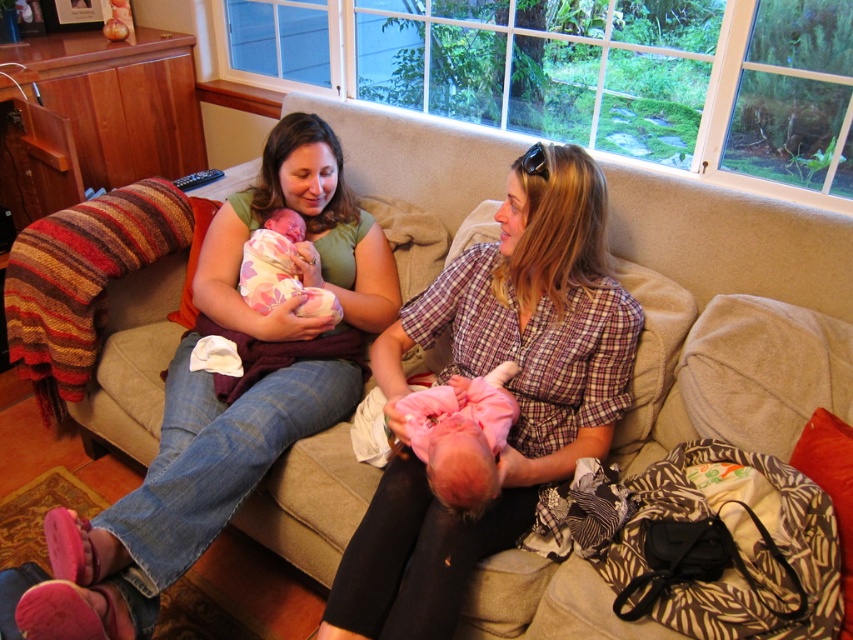
You are standing in the living room and want to hand a gift to the person wearing the matte green shirt at upper left. Based on their position, where should you approach from to ensure you are facing them directly?

The matte green shirt at upper left is located at point (228, 396), so you should approach from the left side to face them directly.

You are a photographer taking a picture of the two women on the couch. You want to ensure both the matte green shirt at upper left and the matte plaid shirt at center are clearly visible in the frame. Which shirt should you focus on first to ensure the closest subject is in focus?

The matte green shirt at upper left is positioned on the left side of matte plaid shirt at center, so focusing on the matte green shirt at upper left first would ensure the closest subject is in focus.

You are a photographer setting up for a family photo. You see the matte plaid shirt at center and the pink soft fabric baby at center. Which one is positioned higher in the image?

The matte plaid shirt at center is above the pink soft fabric baby at center, so the matte plaid shirt at center is positioned higher in the image.